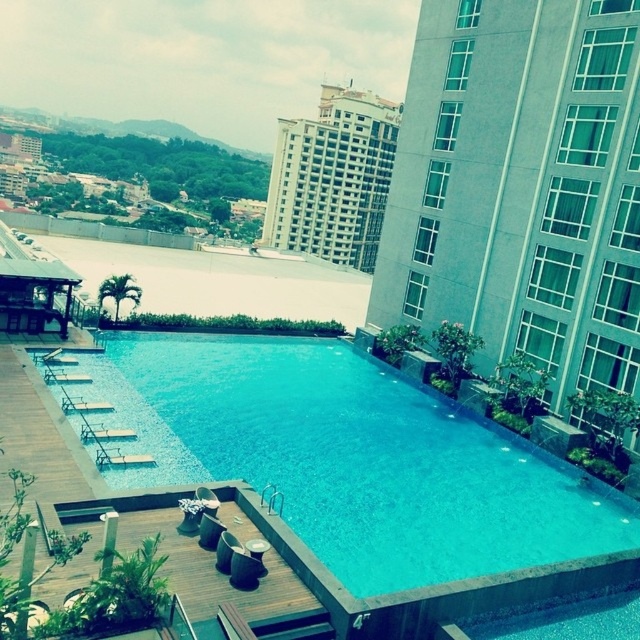
Between white glass building at upper right and white glossy building at upper center, which one is positioned lower?

white glass building at upper right is lower down.

Which is behind, point (483, 51) or point (301, 188)?

The point (301, 188) is behind.

Where is `white glass building at upper right`? This screenshot has height=640, width=640. white glass building at upper right is located at coordinates (522, 188).

Measure the distance between blue tile swimming pool at center and white glossy building at upper center.

They are 146.88 meters apart.

Is point (596, 518) farther from camera compared to point (372, 236)?

No, it is not.

You are a GUI agent. You are given a task and a screenshot of the screen. Output one action in this format:
    pyautogui.click(x=<x>, y=<y>)
    Task: Click on the blue tile swimming pool at center
    The width and height of the screenshot is (640, 640).
    Given the screenshot: What is the action you would take?
    pyautogui.click(x=353, y=458)

Who is higher up, blue tile swimming pool at center or white glass building at upper right?

white glass building at upper right is higher up.

Based on the photo, can you confirm if blue tile swimming pool at center is positioned to the left of white glass building at upper right?

Yes, blue tile swimming pool at center is to the left of white glass building at upper right.

This screenshot has width=640, height=640. Find the location of `blue tile swimming pool at center`. blue tile swimming pool at center is located at coordinates (353, 458).

At what (x,y) coordinates should I click in order to perform the action: click on blue tile swimming pool at center. Please return your answer as a coordinate pair (x, y). This screenshot has width=640, height=640. Looking at the image, I should click on (353, 458).